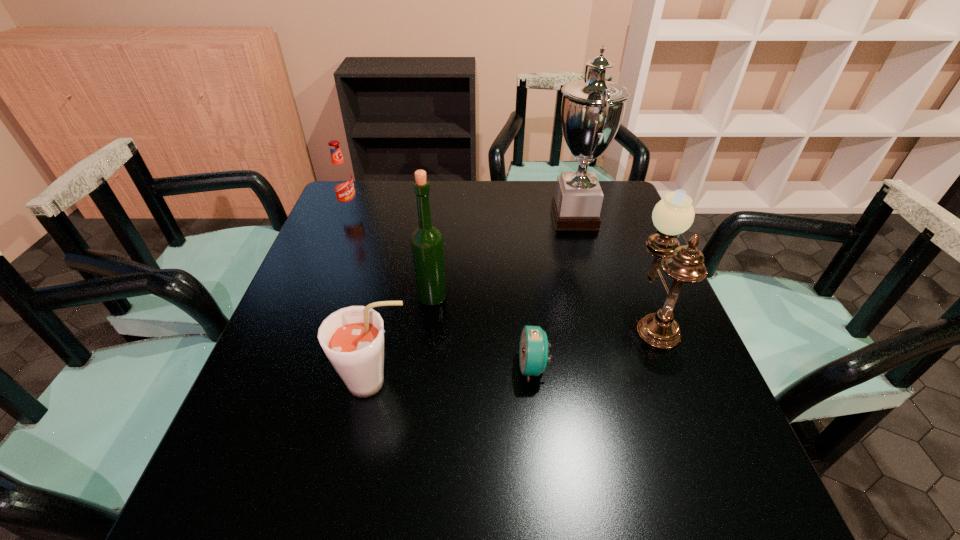
You are a GUI agent. You are given a task and a screenshot of the screen. Output one action in this format:
    pyautogui.click(x=<x>, y=<y>)
    Task: Click on the fourth closest object to the nearer root beer
    
    Given the screenshot: What is the action you would take?
    pyautogui.click(x=592, y=110)

Locate which object is the third closest to the oil lamp. Please provide its 2D coordinates. Your answer should be formatted as a tuple, i.e. [(x, y)], where the tuple contains the x and y coordinates of a point satisfying the conditions above.

[(427, 246)]

Where is `free location that satisfies the following two spatial constraints: 1. on the front side of the oil lamp; 2. on the front-facing side of the alarm clock`? The width and height of the screenshot is (960, 540). free location that satisfies the following two spatial constraints: 1. on the front side of the oil lamp; 2. on the front-facing side of the alarm clock is located at coordinates 671,367.

Locate an element on the screen. The image size is (960, 540). free region that satisfies the following two spatial constraints: 1. on the front side of the left root beer; 2. on the left side of the liquor is located at coordinates (314, 297).